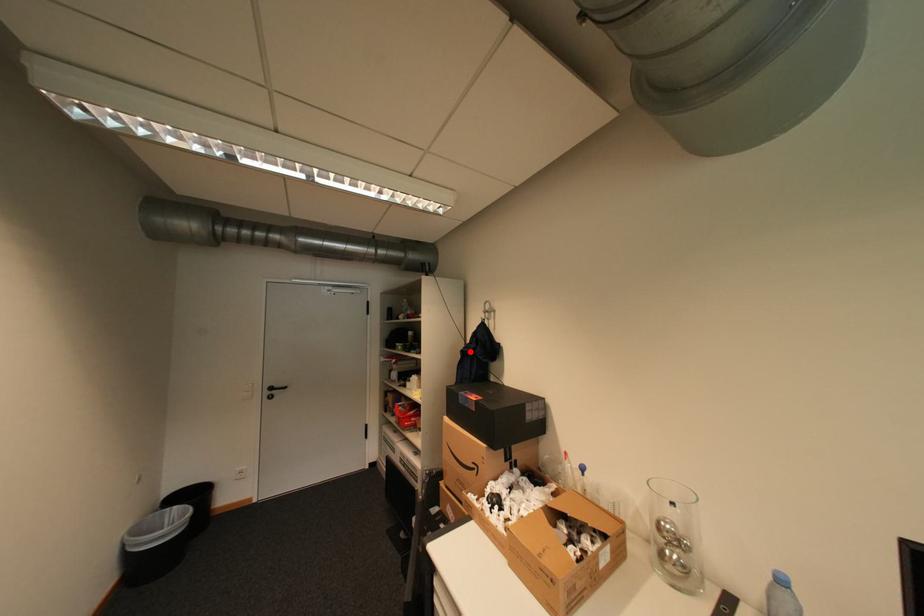
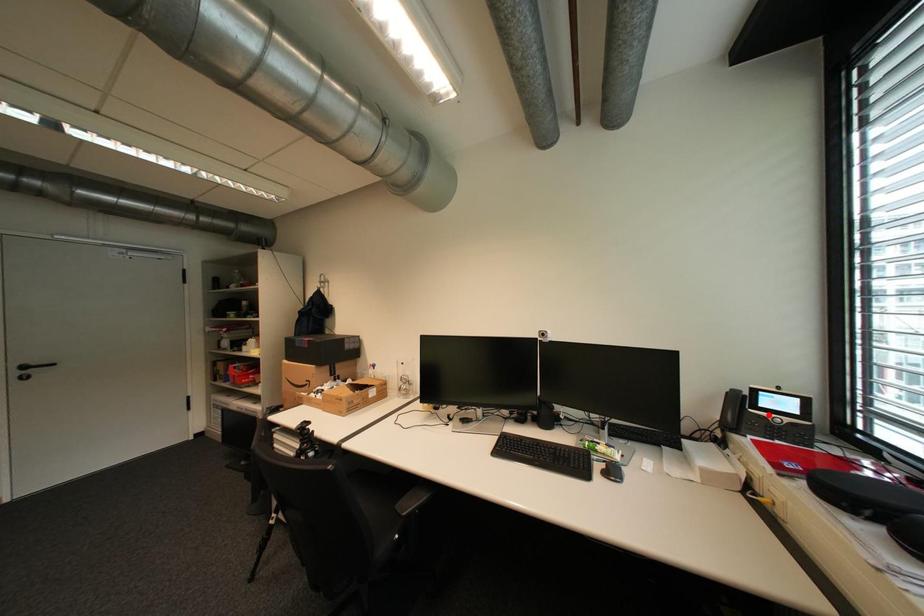
I am providing you with two images of the same scene from different viewpoints. A red point is marked on the first image and another point is marked on the second image. Is the red point in image1 aligned with the point shown in image2?

No